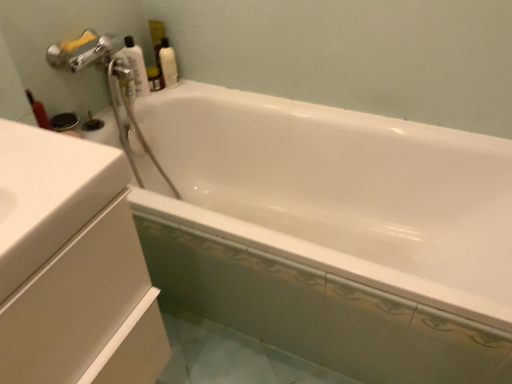
This screenshot has width=512, height=384. Describe the element at coordinates (136, 65) in the screenshot. I see `white glossy bottle at upper left, the first cleaning product positioned from the left` at that location.

I want to click on white glossy bottle at upper right, the 1th cleaning product in the right-to-left sequence, so click(x=168, y=64).

From the image's perspective, which is above, white glossy bottle at upper left, placed as the 2th cleaning product when sorted from right to left, or white glossy bottle at upper right, the 1th cleaning product in the right-to-left sequence?

white glossy bottle at upper right, the 1th cleaning product in the right-to-left sequence, is shown above in the image.

In the scene shown: Which is correct: white glossy bottle at upper left, the first cleaning product positioned from the left, is inside white glossy bottle at upper right, placed as the second cleaning product when sorted from left to right, or outside of it?

white glossy bottle at upper left, the first cleaning product positioned from the left, is located beyond the bounds of white glossy bottle at upper right, placed as the second cleaning product when sorted from left to right.

Is white glossy bottle at upper left, placed as the 2th cleaning product when sorted from right to left, oriented towards white glossy bottle at upper right, the 1th cleaning product in the right-to-left sequence?

No, white glossy bottle at upper left, placed as the 2th cleaning product when sorted from right to left, is not oriented towards white glossy bottle at upper right, the 1th cleaning product in the right-to-left sequence.

Which object is wider, white glossy cabinet at left or white glossy bottle at upper left, placed as the 2th cleaning product when sorted from right to left?

Wider between the two is white glossy cabinet at left.

Does white glossy cabinet at left have a smaller size compared to white glossy bottle at upper left, placed as the 2th cleaning product when sorted from right to left?

No.

Who is taller, white glossy cabinet at left or white glossy bottle at upper left, the first cleaning product positioned from the left?

white glossy cabinet at left is taller.

Which is closer to the camera, (19, 231) or (258, 139)?

Clearly, point (19, 231) is closer to the camera than point (258, 139).

Between white glossy cabinet at left and white glossy bathtub at upper center, which one has smaller size?

white glossy cabinet at left.

How distant is white glossy cabinet at left from white glossy bathtub at upper center?

They are 83.22 centimeters apart.

Which is behind, white glossy cabinet at left or white glossy bathtub at upper center?

white glossy bathtub at upper center is further from the camera.

How much distance is there between white glossy bathtub at upper center and white glossy bottle at upper left, the first cleaning product positioned from the left?

white glossy bathtub at upper center and white glossy bottle at upper left, the first cleaning product positioned from the left, are 23.66 inches apart from each other.

Which of these two, white glossy bathtub at upper center or white glossy bottle at upper left, placed as the 2th cleaning product when sorted from right to left, is smaller?

Smaller between the two is white glossy bottle at upper left, placed as the 2th cleaning product when sorted from right to left.

Which object is further away from the camera taking this photo, white glossy bathtub at upper center or white glossy bottle at upper left, the first cleaning product positioned from the left?

white glossy bottle at upper left, the first cleaning product positioned from the left, is more distant.

How many degrees apart are the facing directions of white glossy bathtub at upper center and white glossy bottle at upper left, placed as the 2th cleaning product when sorted from right to left?

The angular difference between white glossy bathtub at upper center and white glossy bottle at upper left, placed as the 2th cleaning product when sorted from right to left, is 90 degrees.

Is white glossy bottle at upper right, the 1th cleaning product in the right-to-left sequence, bigger than white glossy cabinet at left?

No.

Where is `bathroom cabinet below the white glossy bottle at upper right, the 1th cleaning product in the right-to-left sequence (from the image's perspective)`? The height and width of the screenshot is (384, 512). bathroom cabinet below the white glossy bottle at upper right, the 1th cleaning product in the right-to-left sequence (from the image's perspective) is located at coordinates (71, 264).

Does white glossy bottle at upper right, placed as the second cleaning product when sorted from left to right, lie behind white glossy cabinet at left?

Yes, white glossy bottle at upper right, placed as the second cleaning product when sorted from left to right, is behind white glossy cabinet at left.

Can you confirm if white glossy bottle at upper right, the 1th cleaning product in the right-to-left sequence, is thinner than white glossy cabinet at left?

Yes, white glossy bottle at upper right, the 1th cleaning product in the right-to-left sequence, is thinner than white glossy cabinet at left.

Locate an element on the screen. The height and width of the screenshot is (384, 512). bathtub on the right of white glossy cabinet at left is located at coordinates (338, 192).

Can you see white glossy bathtub at upper center touching white glossy cabinet at left?

No, white glossy bathtub at upper center is not touching white glossy cabinet at left.

Who is bigger, white glossy bathtub at upper center or white glossy cabinet at left?

With larger size is white glossy bathtub at upper center.

Does white glossy bathtub at upper center have a lesser height compared to white glossy cabinet at left?

Yes, white glossy bathtub at upper center is shorter than white glossy cabinet at left.

Considering the positions of points (507, 269) and (159, 59), is point (507, 269) farther from camera compared to point (159, 59)?

No, it is not.

From the image's perspective, which is above, white glossy bathtub at upper center or white glossy bottle at upper right, the 1th cleaning product in the right-to-left sequence?

white glossy bottle at upper right, the 1th cleaning product in the right-to-left sequence.

Looking at this image, can you tell me how much white glossy bathtub at upper center and white glossy bottle at upper right, the 1th cleaning product in the right-to-left sequence, differ in facing direction?

The angular difference between white glossy bathtub at upper center and white glossy bottle at upper right, the 1th cleaning product in the right-to-left sequence, is 90 degrees.

The width and height of the screenshot is (512, 384). Identify the location of cleaning product behind the white glossy bottle at upper left, placed as the 2th cleaning product when sorted from right to left. (168, 64).

The height and width of the screenshot is (384, 512). I want to click on bathroom cabinet below the white glossy bottle at upper left, placed as the 2th cleaning product when sorted from right to left (from the image's perspective), so click(x=71, y=264).

Considering their positions, is white glossy cabinet at left positioned further to white glossy bottle at upper left, the first cleaning product positioned from the left, than white glossy bottle at upper right, the 1th cleaning product in the right-to-left sequence?

The object further to white glossy bottle at upper left, the first cleaning product positioned from the left, is white glossy cabinet at left.

Based on their spatial positions, is white glossy bottle at upper left, placed as the 2th cleaning product when sorted from right to left, or white glossy cabinet at left closer to white glossy bottle at upper right, placed as the second cleaning product when sorted from left to right?

Among the two, white glossy bottle at upper left, placed as the 2th cleaning product when sorted from right to left, is located nearer to white glossy bottle at upper right, placed as the second cleaning product when sorted from left to right.

When comparing their distances from white glossy bottle at upper left, the first cleaning product positioned from the left, does white glossy bottle at upper right, placed as the second cleaning product when sorted from left to right, or white glossy bathtub at upper center seem further?

Based on the image, white glossy bathtub at upper center appears to be further to white glossy bottle at upper left, the first cleaning product positioned from the left.

Looking at the image, which one is located further to white glossy cabinet at left, white glossy bathtub at upper center or white glossy bottle at upper left, placed as the 2th cleaning product when sorted from right to left?

white glossy bottle at upper left, placed as the 2th cleaning product when sorted from right to left, is positioned further to the anchor white glossy cabinet at left.

Based on the photo, when comparing their distances from white glossy bottle at upper left, placed as the 2th cleaning product when sorted from right to left, does white glossy bathtub at upper center or white glossy cabinet at left seem closer?

The object closer to white glossy bottle at upper left, placed as the 2th cleaning product when sorted from right to left, is white glossy bathtub at upper center.

Looking at the image, which one is located closer to white glossy bottle at upper left, placed as the 2th cleaning product when sorted from right to left, white glossy bathtub at upper center or white glossy bottle at upper right, the 1th cleaning product in the right-to-left sequence?

Based on the image, white glossy bottle at upper right, the 1th cleaning product in the right-to-left sequence, appears to be nearer to white glossy bottle at upper left, placed as the 2th cleaning product when sorted from right to left.

Based on the photo, from the image, which object appears to be farther from white glossy bottle at upper right, the 1th cleaning product in the right-to-left sequence, white glossy cabinet at left or white glossy bathtub at upper center?

Based on the image, white glossy cabinet at left appears to be further to white glossy bottle at upper right, the 1th cleaning product in the right-to-left sequence.

When comparing their distances from white glossy cabinet at left, does white glossy bottle at upper left, placed as the 2th cleaning product when sorted from right to left, or white glossy bathtub at upper center seem closer?

Among the two, white glossy bathtub at upper center is located nearer to white glossy cabinet at left.

The height and width of the screenshot is (384, 512). I want to click on bathtub located between white glossy cabinet at left and white glossy bottle at upper left, the first cleaning product positioned from the left, in the depth direction, so click(x=338, y=192).

You are a GUI agent. You are given a task and a screenshot of the screen. Output one action in this format:
    pyautogui.click(x=<x>, y=<y>)
    Task: Click on the bathtub positioned between white glossy cabinet at left and white glossy bottle at upper right, the 1th cleaning product in the right-to-left sequence, from near to far
    This screenshot has height=384, width=512.
    Given the screenshot: What is the action you would take?
    pyautogui.click(x=338, y=192)

This screenshot has height=384, width=512. In order to click on cleaning product between white glossy bathtub at upper center and white glossy bottle at upper right, the 1th cleaning product in the right-to-left sequence, from front to back in this screenshot , I will do `click(136, 65)`.

Where is `cleaning product between white glossy cabinet at left and white glossy bottle at upper right, placed as the second cleaning product when sorted from left to right, along the z-axis`? This screenshot has width=512, height=384. cleaning product between white glossy cabinet at left and white glossy bottle at upper right, placed as the second cleaning product when sorted from left to right, along the z-axis is located at coordinates (136, 65).